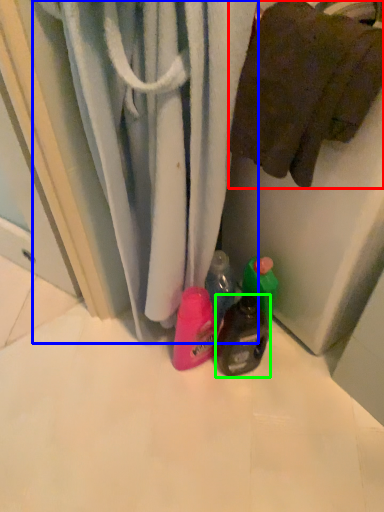
Question: Which object is the closest to the towel (highlighted by a red box)? Choose among these: curtain (highlighted by a blue box) or bottle (highlighted by a green box).

Choices:
 (A) curtain
 (B) bottle

Answer: (A)